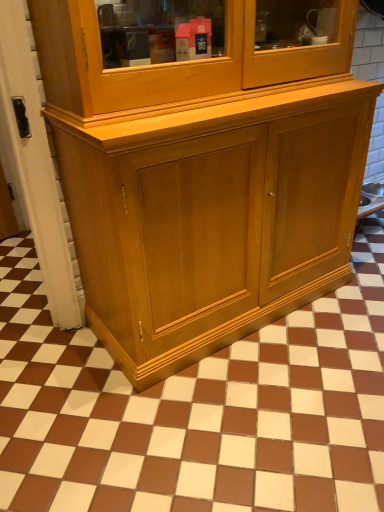
Question: Should I look upward or downward to see brown glossy tile at center?

Choices:
 (A) down
 (B) up

Answer: (A)